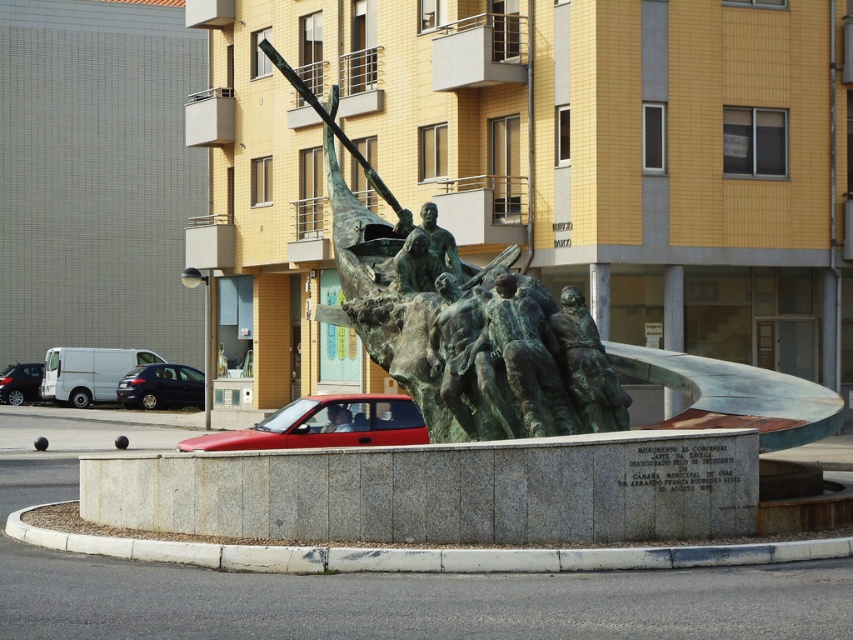
Question: Which object appears farthest from the camera in this image?

Choices:
 (A) shiny black car at lower left
 (B) shiny red car at center
 (C) matte black van at left

Answer: (C)

Question: Which of the following is the farthest from the observer?

Choices:
 (A) (4, 378)
 (B) (354, 321)
 (C) (190, 385)
 (D) (409, 403)

Answer: (A)

Question: Can you confirm if shiny red car at center is thinner than matte black van at left?

Choices:
 (A) no
 (B) yes

Answer: (A)

Question: Is bronze statue at center above shiny black car at lower left?

Choices:
 (A) no
 (B) yes

Answer: (B)

Question: Does shiny red car at center come behind shiny black car at lower left?

Choices:
 (A) no
 (B) yes

Answer: (A)

Question: Among these objects, which one is nearest to the camera?

Choices:
 (A) shiny black car at lower left
 (B) matte black van at left
 (C) shiny red car at center
 (D) bronze statue at center

Answer: (D)